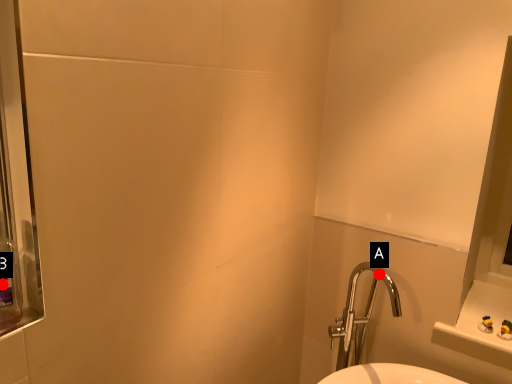
Question: Two points are circled on the image, labeled by A and B beside each circle. Which point is farther to the camera?

Choices:
 (A) A is further
 (B) B is further

Answer: (A)